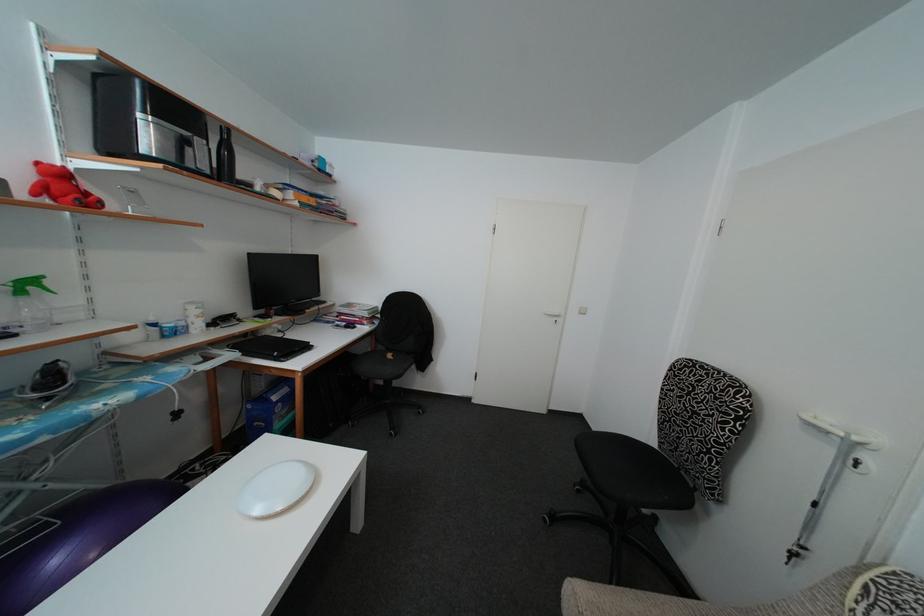
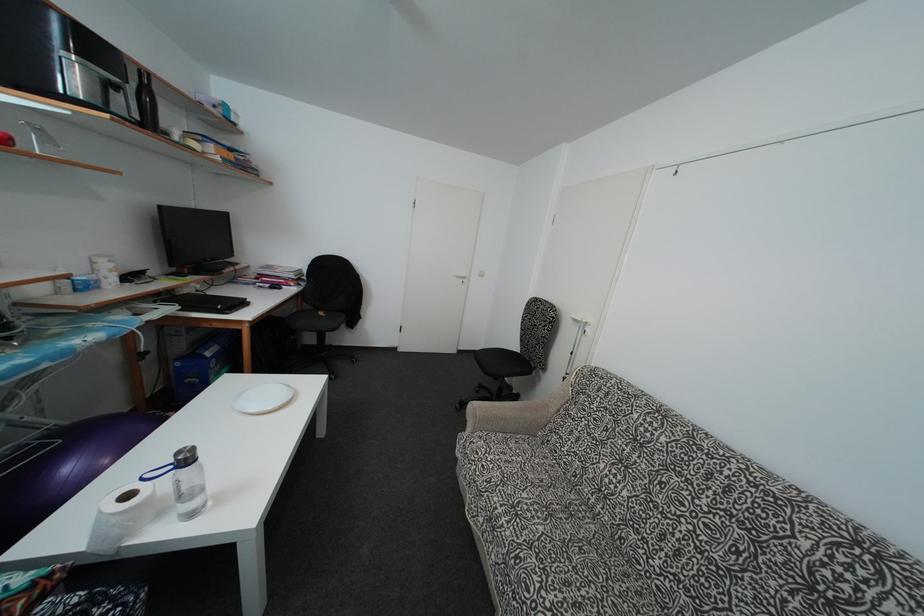
Where in the second image is the point corresponding to [259,430] from the first image?

(190, 387)